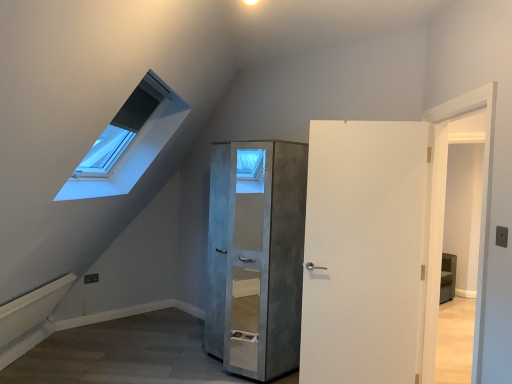
Identify the location of free point to the left of concrete textured cabinet at center. coord(175,361).